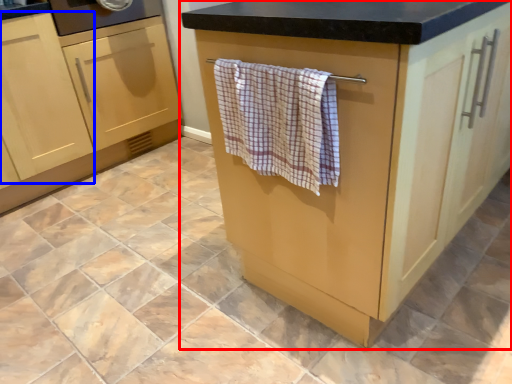
Question: Which of the following is the farthest to the observer, cabinetry (highlighted by a red box) or cabinetry (highlighted by a blue box)?

Choices:
 (A) cabinetry
 (B) cabinetry

Answer: (B)